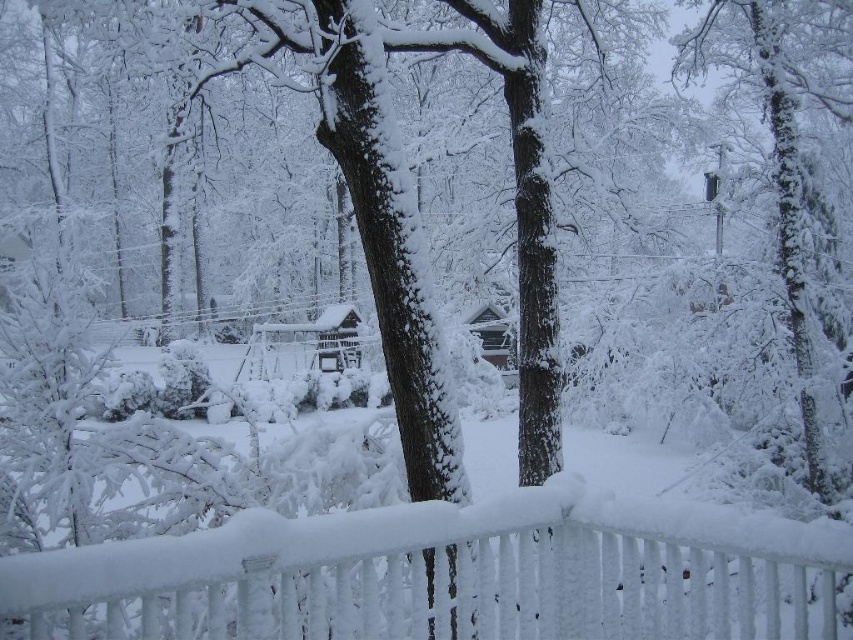
You are standing in the winter scene and want to walk towards the white frosted fence at lower center. Based on its 2D coordinates, in which direction should you move relative to your current position?

The white frosted fence at lower center is located at coordinates 0.900 on the x and 0.530 on the y. Since the x value is high, you should move to the right to reach it.